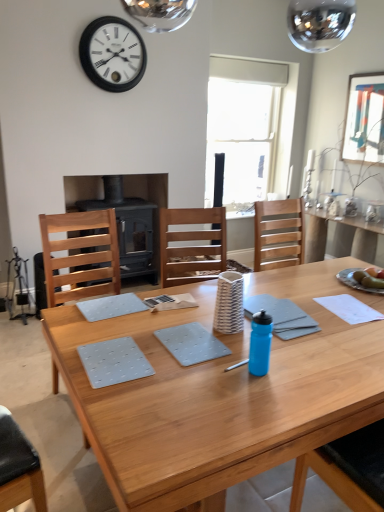
This screenshot has width=384, height=512. In order to click on free space above light gray fabric placemat at center, marked as the 1th place mat in a back-to-front arrangement (from a real-world perspective) in this screenshot , I will do `click(108, 304)`.